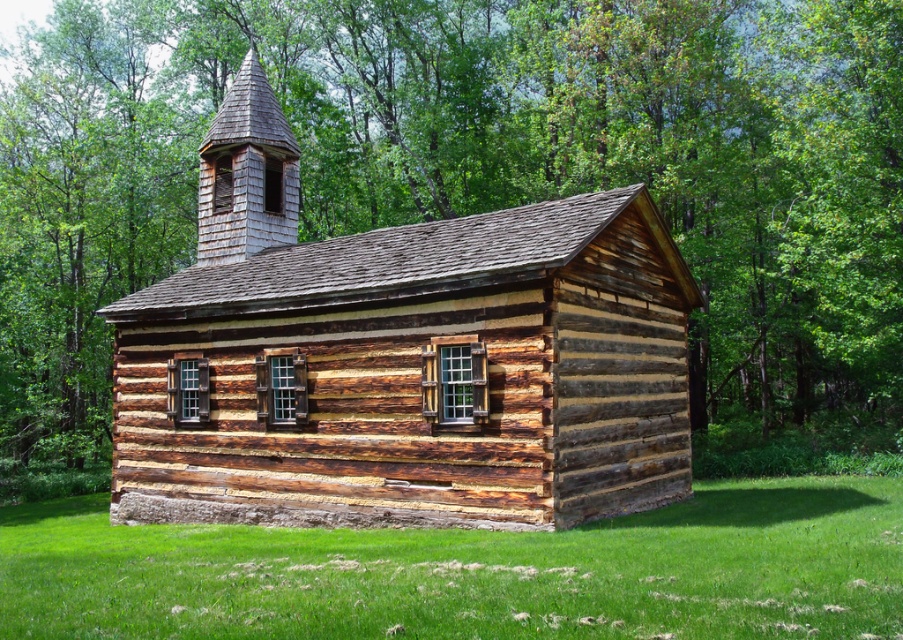
Question: Can you confirm if weathered wood log cabin at center is positioned to the right of green grass at lower center?

Choices:
 (A) no
 (B) yes

Answer: (A)

Question: Among these points, which one is farthest from the camera?

Choices:
 (A) (277, 484)
 (B) (867, 596)

Answer: (A)

Question: Is weathered wood log cabin at center wider than green grass at lower center?

Choices:
 (A) yes
 (B) no

Answer: (B)

Question: Which object appears farthest from the camera in this image?

Choices:
 (A) weathered wood log cabin at center
 (B) green grass at lower center

Answer: (A)

Question: Which object is closer to the camera taking this photo?

Choices:
 (A) weathered wood log cabin at center
 (B) green grass at lower center

Answer: (B)

Question: Can you confirm if weathered wood log cabin at center is positioned to the left of green grass at lower center?

Choices:
 (A) yes
 (B) no

Answer: (A)